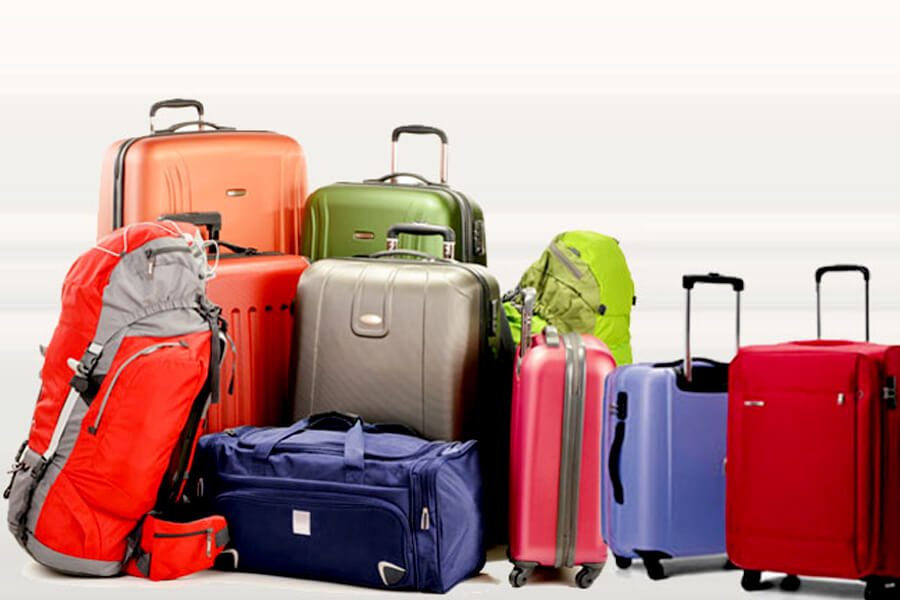
Locate an element on the screen. handles is located at coordinates (400, 226), (421, 127), (195, 109), (379, 282), (698, 277), (852, 259), (523, 303), (198, 216).